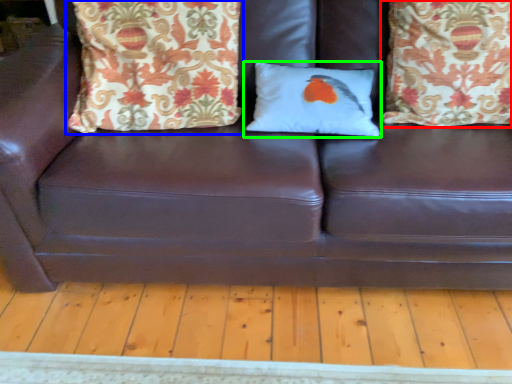
Question: Considering the real-world distances, which object is closest to pillow (highlighted by a red box)? pillow (highlighted by a blue box) or pillow (highlighted by a green box).

Choices:
 (A) pillow
 (B) pillow

Answer: (B)